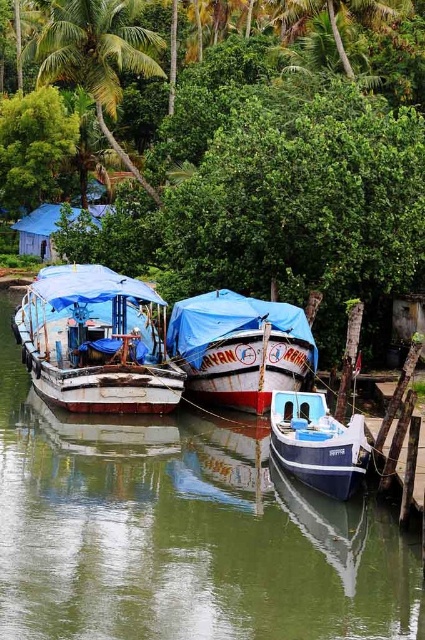
Question: Which point is closer to the camera?

Choices:
 (A) (70, 419)
 (B) (70, 356)
 (C) (215, 67)
 (D) (339, 464)

Answer: (D)

Question: Observing the image, what is the correct spatial positioning of rusty metal boat at left in reference to white wooden boat at center?

Choices:
 (A) below
 (B) above

Answer: (B)

Question: Which of these objects is positioned farthest from the blue glossy boat at center?

Choices:
 (A) green leafy palm tree at upper left
 (B) green leafy tree at upper center

Answer: (A)

Question: Is white wooden boat at center positioned at the back of blue tarpaulin hut at upper left?

Choices:
 (A) yes
 (B) no

Answer: (B)

Question: Which object appears closest to the camera in this image?

Choices:
 (A) green smooth water at center
 (B) rusty metal boat at left
 (C) blue glossy boat at center
 (D) green leafy tree at upper center

Answer: (A)

Question: Does green leafy palm tree at upper left have a lesser width compared to blue glossy boat at center?

Choices:
 (A) yes
 (B) no

Answer: (B)